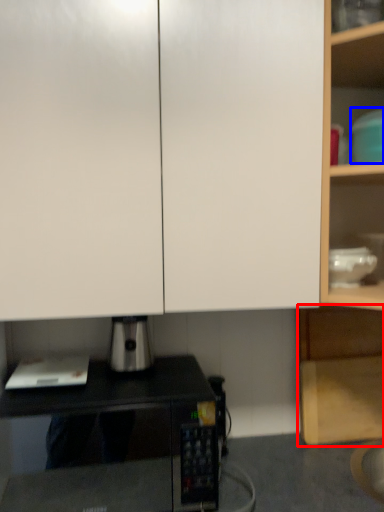
Question: Which object appears closest to the camera in this image, cabinetry (highlighted by a red box) or appliance (highlighted by a blue box)?

Choices:
 (A) cabinetry
 (B) appliance

Answer: (B)